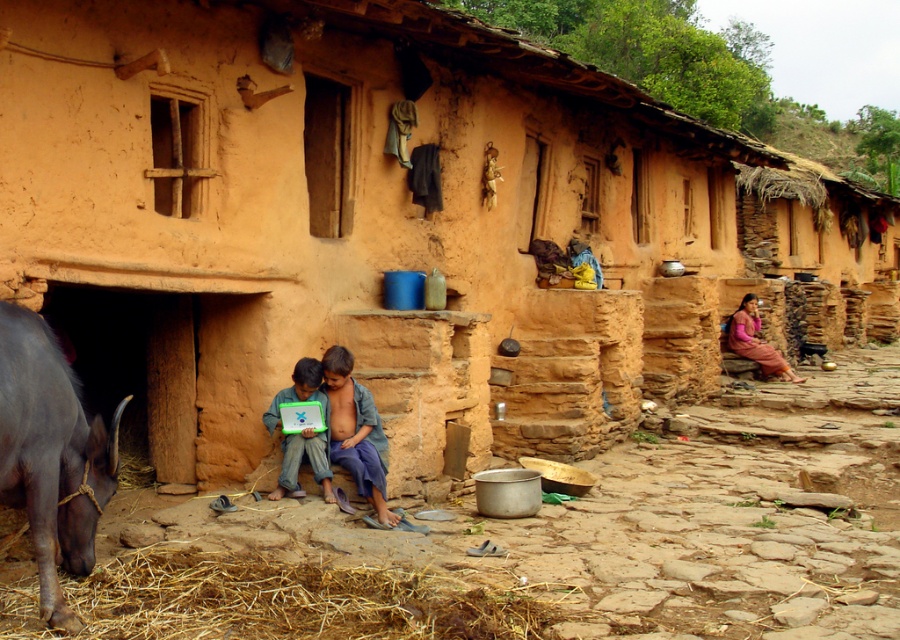
Consider the image. You are a visitor to this rural area and see the brown straw at lower left and the dark gray fur at lower left near the mud brick house. Which object is smaller in size?

The brown straw at lower left is smaller in size compared to the dark gray fur at lower left.

Based on the photo, you are a visitor standing in front of the mud brick house. You see the dark gray fur at lower left and the matte green laptop at lower center. Which object is nearer to you?

The dark gray fur at lower left is closer to the viewer than the matte green laptop at lower center.

You are a photographer trying to capture the two children and their device in the scene. You notice the dark gray fur at lower left and the matte green laptop at lower center. Which object should you focus on first if you want to ensure both are in sharp focus?

The dark gray fur at lower left is above the matte green laptop at lower center, so focusing on the dark gray fur at lower left first would ensure both are in sharp focus since it is closer to the camera.